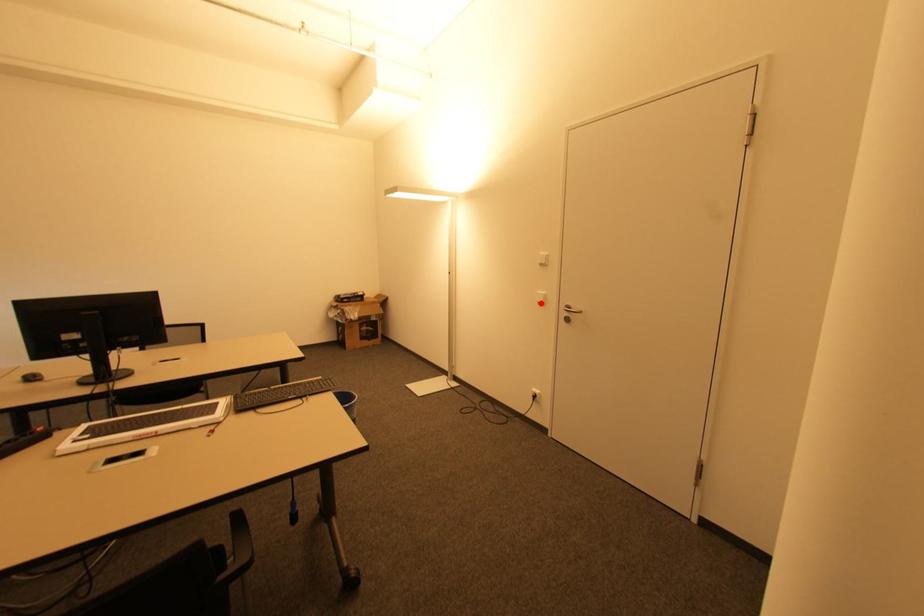
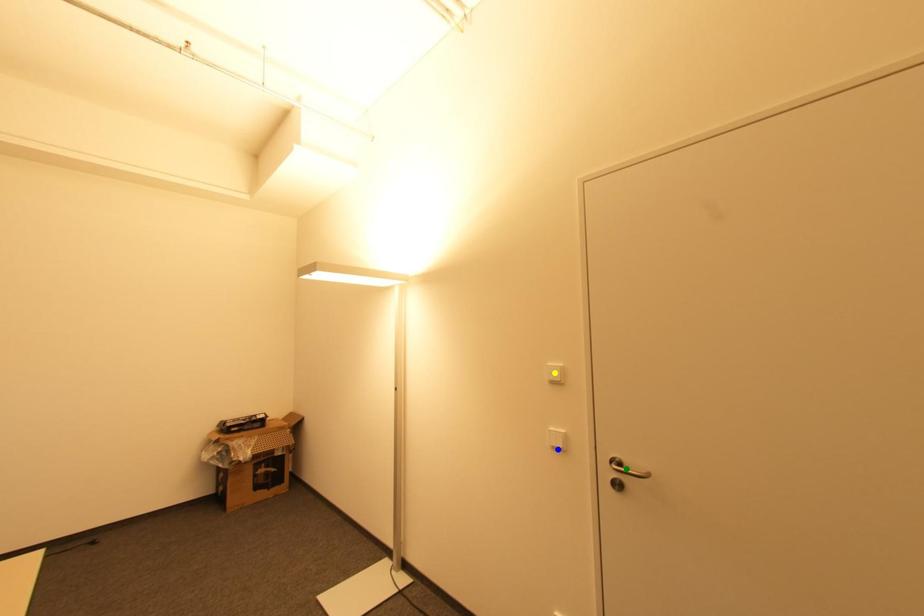
Question: I am providing you with two images of the same scene from different viewpoints. A red point is marked on the first image. You are given multiple points on the second image. Can you choose the point in image 2 that corresponds to the point in image 1?

Choices:
 (A) green point
 (B) blue point
 (C) yellow point

Answer: (B)